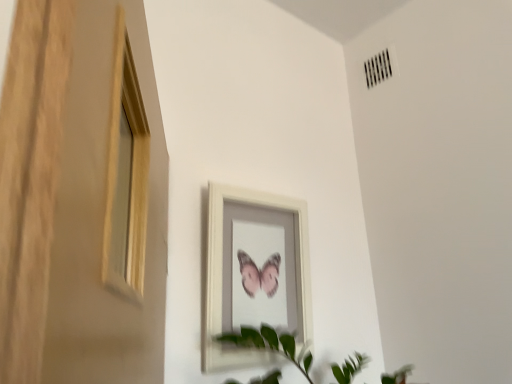
Question: Should I look upward or downward to see white wooden picture frame at center?

Choices:
 (A) up
 (B) down

Answer: (B)